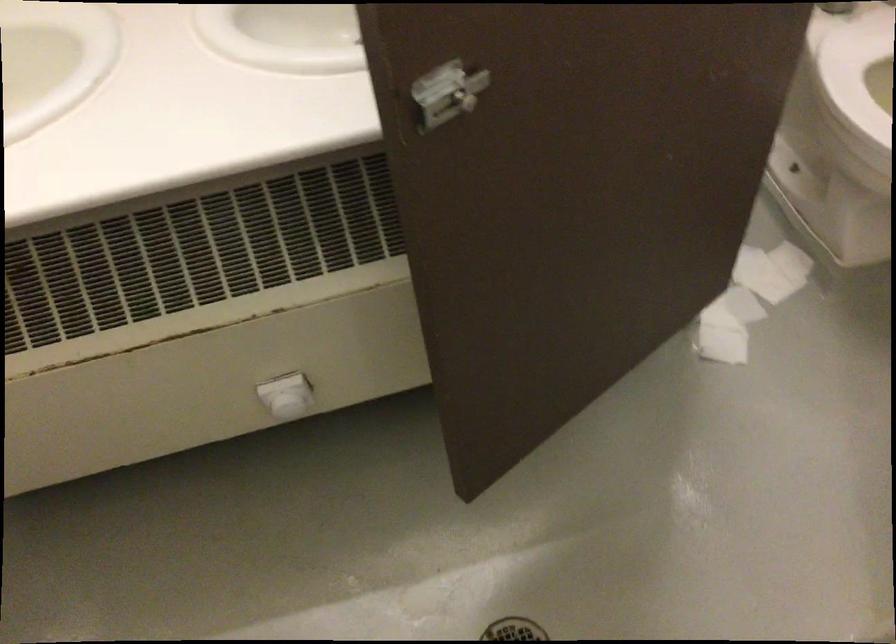
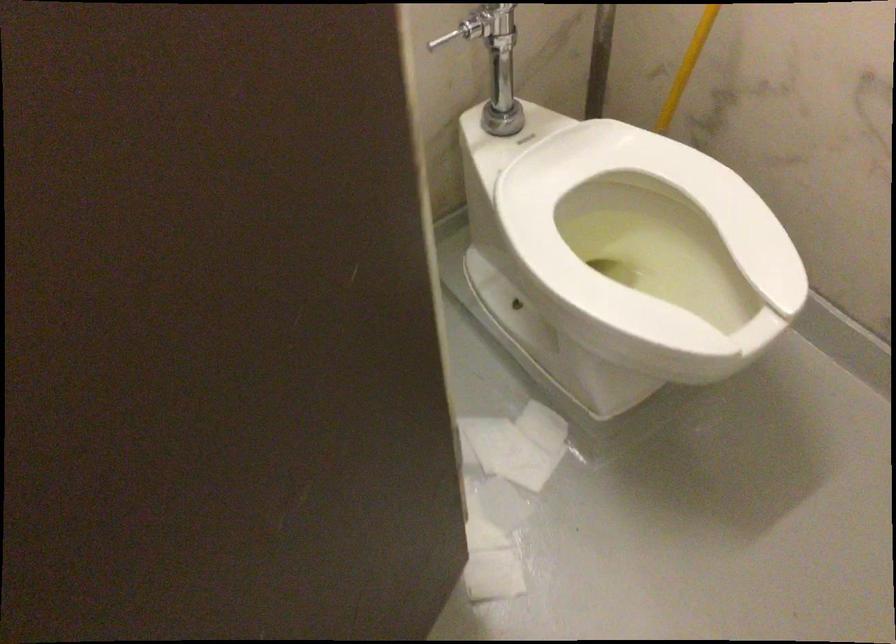
Question: Based on the continuous images, in which direction is the camera rotating? Reply with the corresponding letter.

Choices:
 (A) Left
 (B) Right
 (C) Up
 (D) Down

Answer: (B)